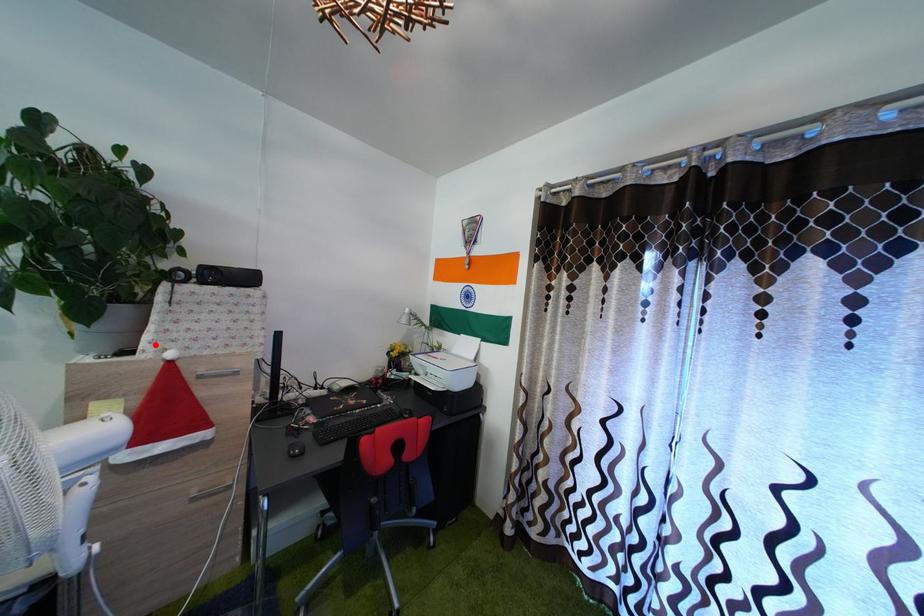
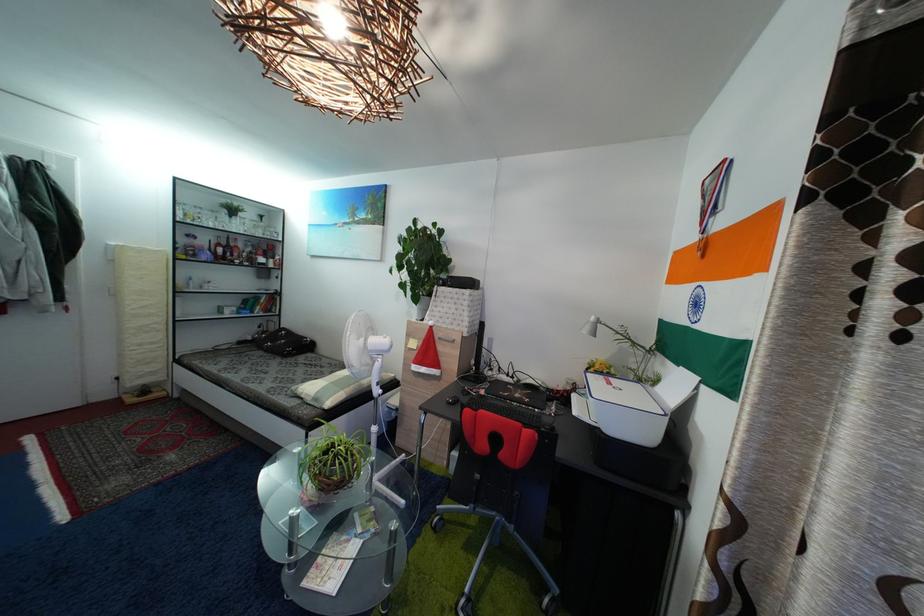
Find the pixel in the second image that matches the highlighted location in the first image.

(435, 321)